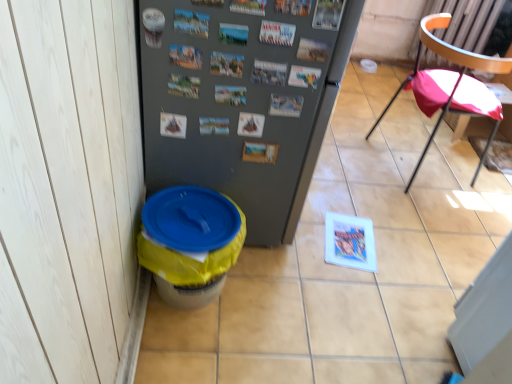
Question: Is gray matte refrigerator at center to the right of yellow plastic trash can at lower left from the viewer's perspective?

Choices:
 (A) yes
 (B) no

Answer: (B)

Question: Is gray matte refrigerator at center bigger than yellow plastic trash can at lower left?

Choices:
 (A) no
 (B) yes

Answer: (B)

Question: Can you confirm if gray matte refrigerator at center is positioned to the left of yellow plastic trash can at lower left?

Choices:
 (A) yes
 (B) no

Answer: (A)

Question: Would you say gray matte refrigerator at center is a long distance from yellow plastic trash can at lower left?

Choices:
 (A) no
 (B) yes

Answer: (A)

Question: Can you confirm if gray matte refrigerator at center is smaller than yellow plastic trash can at lower left?

Choices:
 (A) yes
 (B) no

Answer: (B)

Question: Is gray matte refrigerator at center positioned with its back to yellow plastic trash can at lower left?

Choices:
 (A) no
 (B) yes

Answer: (A)

Question: Does yellow plastic potty at lower left have a smaller size compared to pink fabric chair at right?

Choices:
 (A) yes
 (B) no

Answer: (A)

Question: Considering the relative sizes of yellow plastic potty at lower left and pink fabric chair at right in the image provided, is yellow plastic potty at lower left taller than pink fabric chair at right?

Choices:
 (A) yes
 (B) no

Answer: (B)

Question: Does yellow plastic potty at lower left have a lesser height compared to pink fabric chair at right?

Choices:
 (A) yes
 (B) no

Answer: (A)

Question: Considering the relative positions of yellow plastic potty at lower left and pink fabric chair at right in the image provided, is yellow plastic potty at lower left to the left of pink fabric chair at right from the viewer's perspective?

Choices:
 (A) no
 (B) yes

Answer: (B)

Question: Is pink fabric chair at right located within yellow plastic potty at lower left?

Choices:
 (A) no
 (B) yes

Answer: (A)

Question: Is yellow plastic potty at lower left positioned behind pink fabric chair at right?

Choices:
 (A) no
 (B) yes

Answer: (A)

Question: From a real-world perspective, is gray matte refrigerator at center under pink fabric chair at right?

Choices:
 (A) yes
 (B) no

Answer: (B)